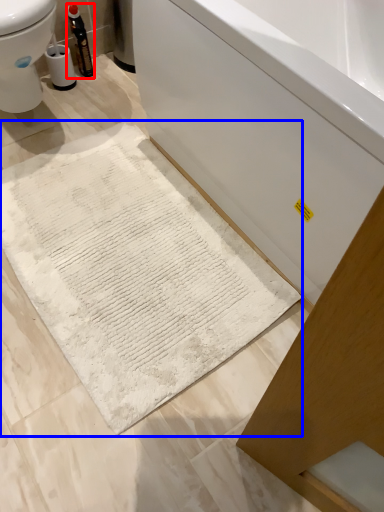
Question: Which object is further to the camera taking this photo, bottle (highlighted by a red box) or bath mat (highlighted by a blue box)?

Choices:
 (A) bottle
 (B) bath mat

Answer: (A)